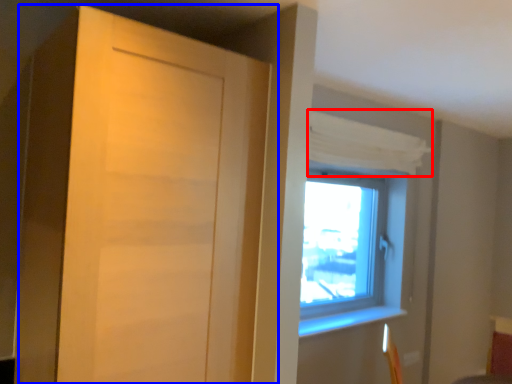
Question: Among these objects, which one is nearest to the camera, curtain (highlighted by a red box) or door (highlighted by a blue box)?

Choices:
 (A) curtain
 (B) door

Answer: (B)